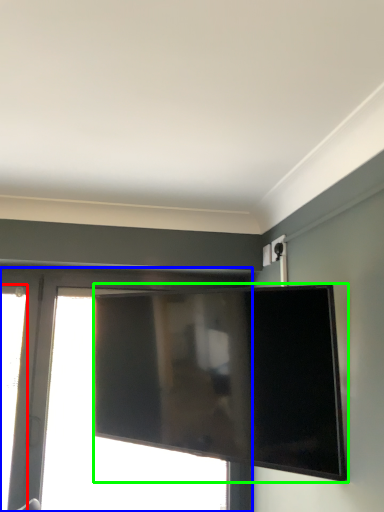
Question: Which is farther away from window (highlighted by a red box)? window (highlighted by a blue box) or television (highlighted by a green box)?

Choices:
 (A) window
 (B) television

Answer: (B)